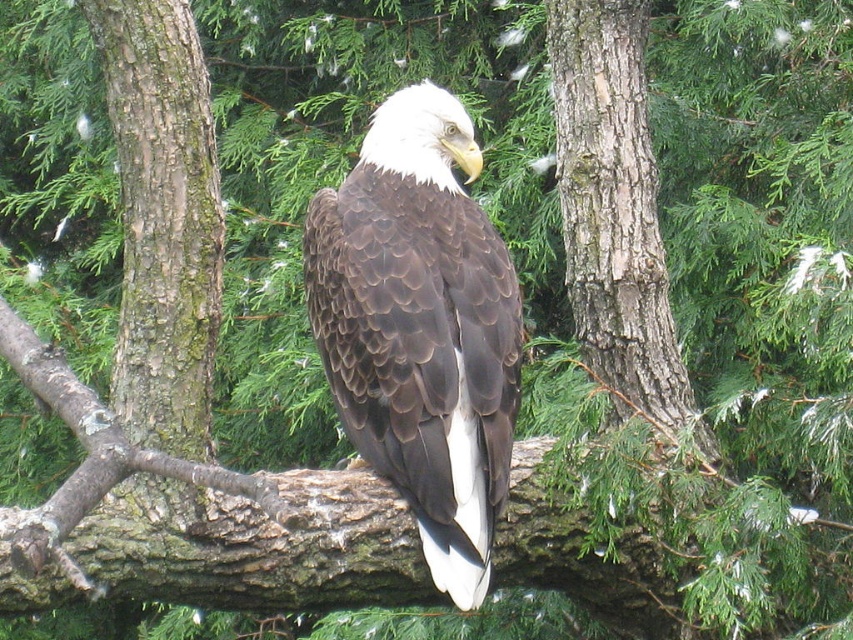
Question: Which point is farther to the camera?

Choices:
 (A) brown rough bark at center
 (B) brown textured feathers at center

Answer: (A)

Question: Which of the following is the closest to the observer?

Choices:
 (A) brown rough bark at center
 (B) brown textured feathers at center

Answer: (B)

Question: Can you confirm if brown textured feathers at center is positioned below brown rough bark at center?

Choices:
 (A) no
 (B) yes

Answer: (B)

Question: Is brown textured feathers at center behind smooth bark tree trunk at center?

Choices:
 (A) no
 (B) yes

Answer: (A)

Question: Does brown textured feathers at center have a greater width compared to brown rough bark at center?

Choices:
 (A) no
 (B) yes

Answer: (B)

Question: Among these objects, which one is nearest to the camera?

Choices:
 (A) smooth bark tree trunk at center
 (B) brown rough bark at center
 (C) brown textured feathers at center

Answer: (C)